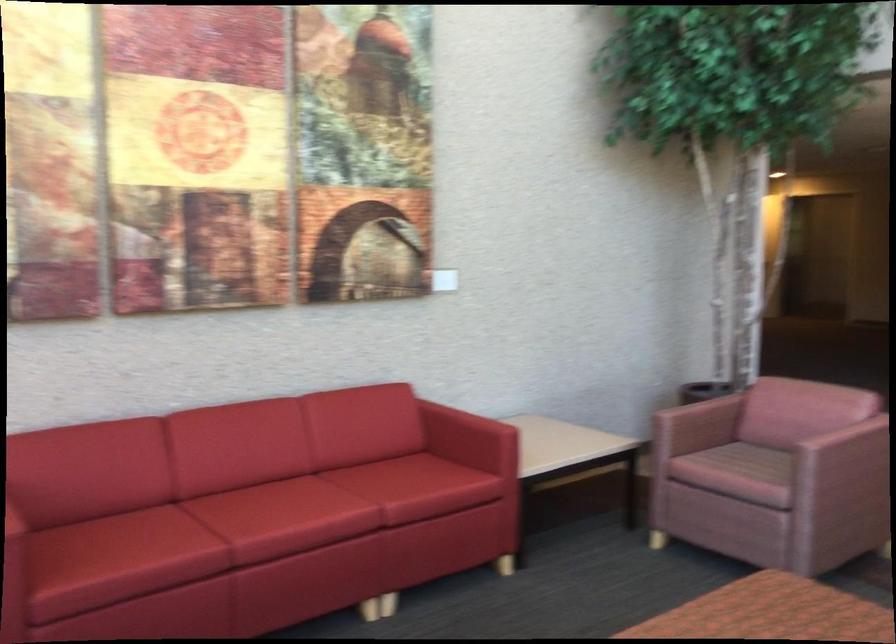
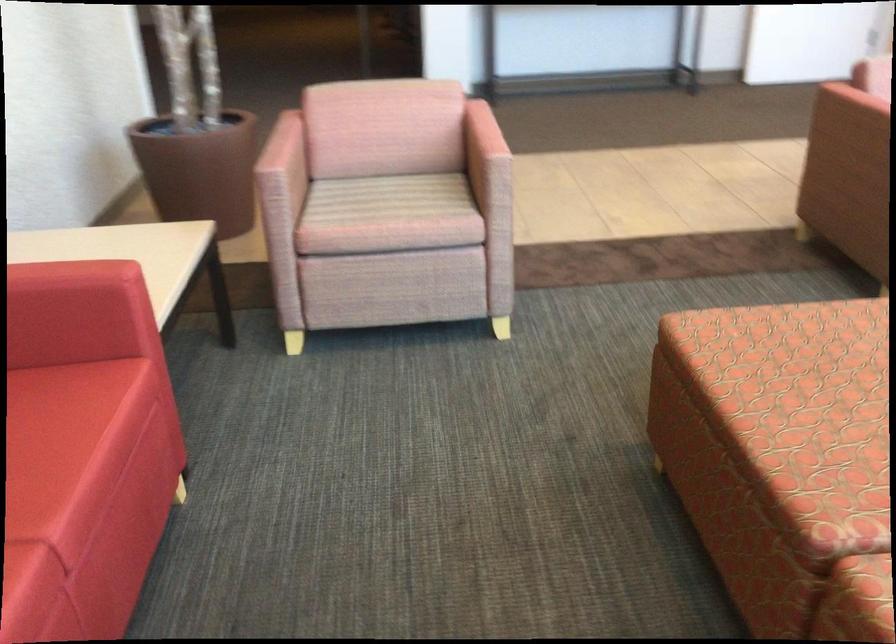
Where in the second image is the point corresponding to point 667,415 from the first image?

(280, 176)